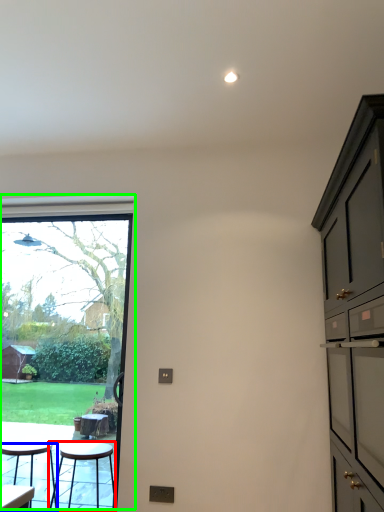
Question: Estimate the real-world distances between objects in this image. Which object is farther from stool (highlighted by a red box), stool (highlighted by a blue box) or window (highlighted by a green box)?

Choices:
 (A) stool
 (B) window

Answer: (B)